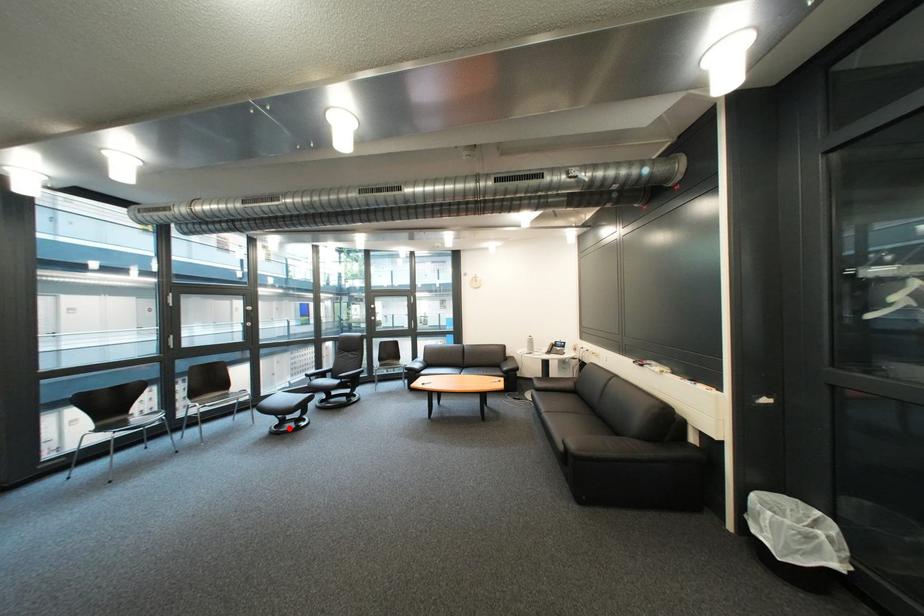
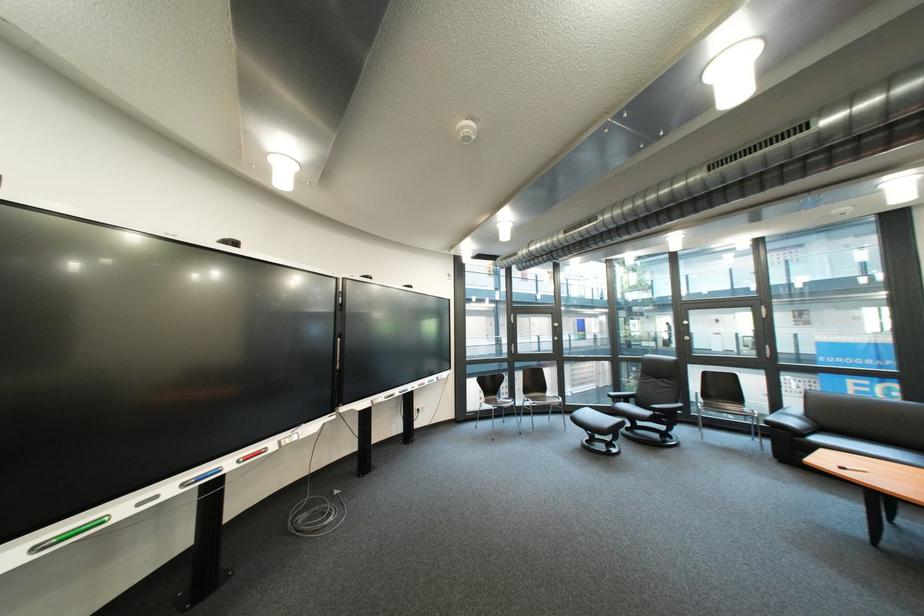
Question: A red point is marked in image1. In image2, is the corresponding 3D point closer to the camera or farther? Reply with the corresponding letter.

Choices:
 (A) The corresponding 3D point is closer.
 (B) The corresponding 3D point is farther.

Answer: (B)